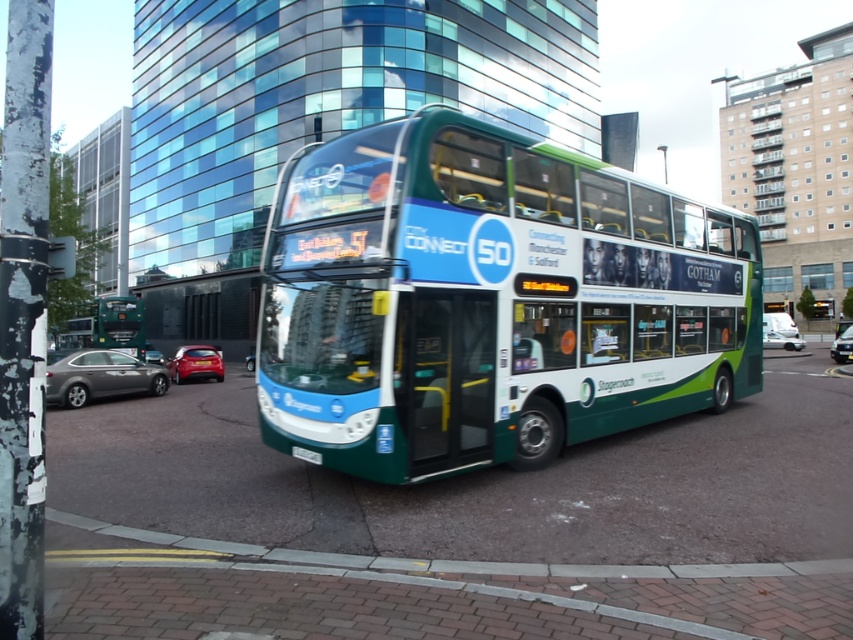
In the scene shown: Is the position of metallic gray sedan at lower left more distant than that of metallic red hatchback at lower left?

No, it is in front of metallic red hatchback at lower left.

Does metallic gray sedan at lower left have a larger size compared to metallic red hatchback at lower left?

No.

The height and width of the screenshot is (640, 853). Describe the element at coordinates (100, 376) in the screenshot. I see `metallic gray sedan at lower left` at that location.

Find the location of `metallic gray sedan at lower left`. metallic gray sedan at lower left is located at coordinates (100, 376).

Does metallic gray sedan at lower left come behind white glossy car at center?

Yes, metallic gray sedan at lower left is further from the viewer.

Can you confirm if metallic gray sedan at lower left is thinner than white glossy car at center?

Indeed, metallic gray sedan at lower left has a lesser width compared to white glossy car at center.

This screenshot has height=640, width=853. I want to click on metallic gray sedan at lower left, so click(x=100, y=376).

Is green matte/decorative double-decker bus at center thinner than white plastic license plate at center?

No, green matte/decorative double-decker bus at center is not thinner than white plastic license plate at center.

Which is below, green matte/decorative double-decker bus at center or white plastic license plate at center?

white plastic license plate at center is below.

At what (x,y) coordinates should I click in order to perform the action: click on green matte/decorative double-decker bus at center. Please return your answer as a coordinate pair (x, y). Image resolution: width=853 pixels, height=640 pixels. Looking at the image, I should click on (490, 300).